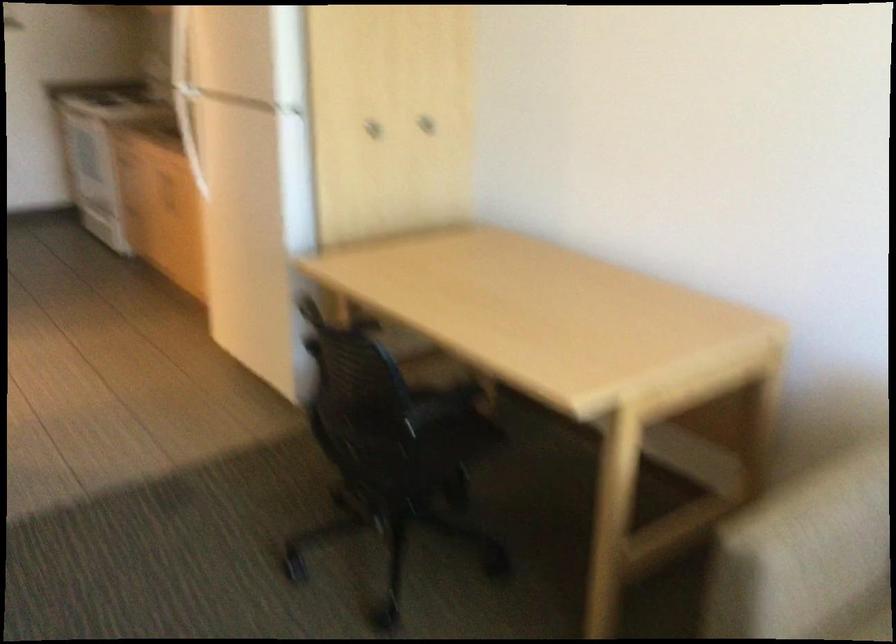
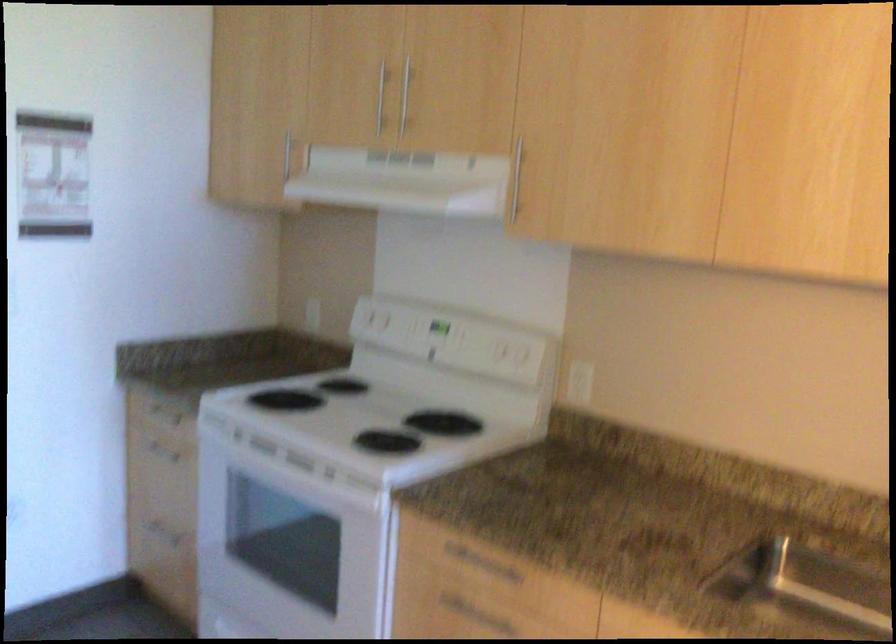
Locate, in the second image, the point that corresponds to point (148, 162) in the first image.

(466, 609)